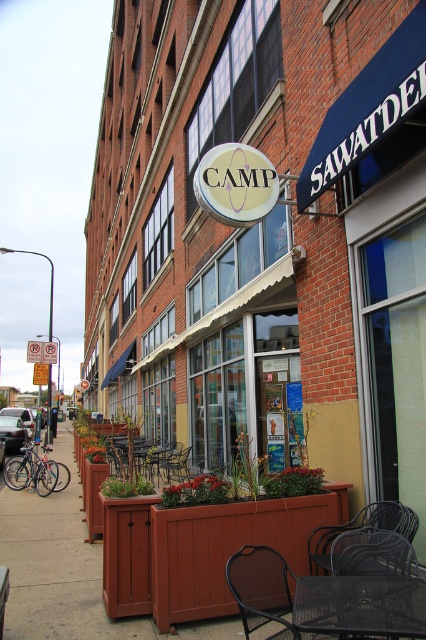
Question: Can you confirm if metallic mesh table at center is positioned below black metal chair at center?

Choices:
 (A) yes
 (B) no

Answer: (B)

Question: Which point is farther to the camera?

Choices:
 (A) metallic dark brown chair at lower right
 (B) wooden chair at center
 (C) black metal chair at center
 (D) metallic mesh table at center

Answer: (B)

Question: Can you confirm if black metal chair at center is positioned below metallic dark brown chair at lower right?

Choices:
 (A) yes
 (B) no

Answer: (B)

Question: Which object is positioned closest to the black metal chair at center?

Choices:
 (A) metallic mesh table at center
 (B) metallic dark brown chair at lower right

Answer: (A)

Question: Can you confirm if metallic dark brown chair at lower right is thinner than wooden chair at center?

Choices:
 (A) no
 (B) yes

Answer: (B)

Question: Which of the following is the closest to the observer?

Choices:
 (A) wooden chair at center
 (B) metallic dark brown chair at lower right
 (C) metallic mesh table at center
 (D) black metal chair at center

Answer: (C)